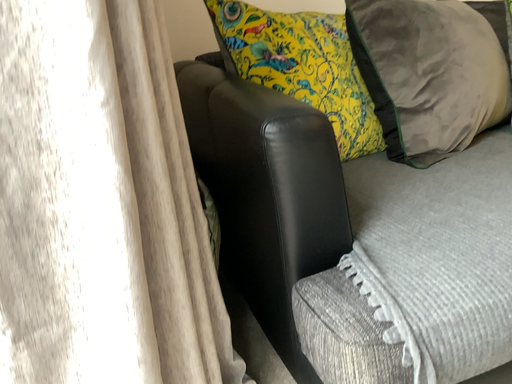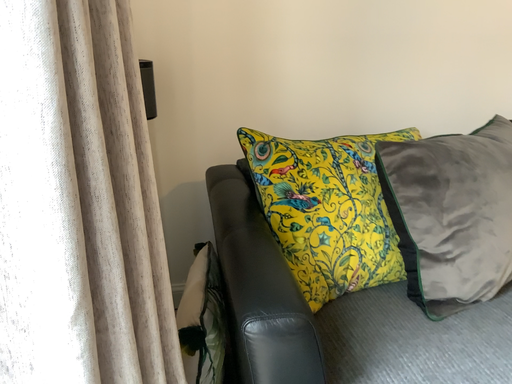
Question: How did the camera likely rotate when shooting the video?

Choices:
 (A) rotated right
 (B) rotated left

Answer: (B)